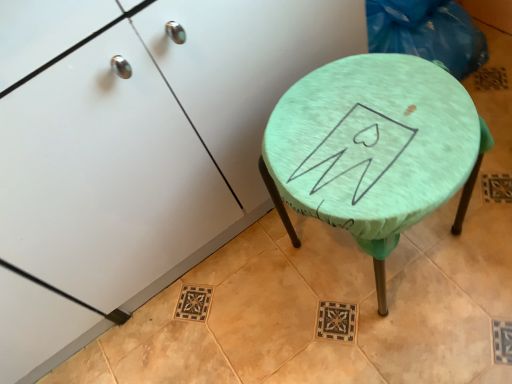
Question: Can you see mint fabric-covered stool at center-right touching teal fabric-covered stool at center?

Choices:
 (A) yes
 (B) no

Answer: (B)

Question: Is mint fabric-covered stool at center-right surrounding teal fabric-covered stool at center?

Choices:
 (A) yes
 (B) no

Answer: (B)

Question: Is mint fabric-covered stool at center-right at the left side of teal fabric-covered stool at center?

Choices:
 (A) no
 (B) yes

Answer: (B)

Question: Is mint fabric-covered stool at center-right positioned beyond the bounds of teal fabric-covered stool at center?

Choices:
 (A) no
 (B) yes

Answer: (B)

Question: Does mint fabric-covered stool at center-right lie behind teal fabric-covered stool at center?

Choices:
 (A) no
 (B) yes

Answer: (A)

Question: Is mint fabric-covered stool at center-right taller than teal fabric-covered stool at center?

Choices:
 (A) yes
 (B) no

Answer: (A)

Question: Could you tell me if teal fabric-covered stool at center is turned towards mint fabric-covered stool at center-right?

Choices:
 (A) no
 (B) yes

Answer: (A)

Question: Is teal fabric-covered stool at center positioned far away from mint fabric-covered stool at center-right?

Choices:
 (A) yes
 (B) no

Answer: (B)

Question: Does teal fabric-covered stool at center appear on the left side of mint fabric-covered stool at center-right?

Choices:
 (A) yes
 (B) no

Answer: (B)

Question: Considering the relative sizes of teal fabric-covered stool at center and mint fabric-covered stool at center-right in the image provided, is teal fabric-covered stool at center smaller than mint fabric-covered stool at center-right?

Choices:
 (A) yes
 (B) no

Answer: (A)

Question: From the image's perspective, is teal fabric-covered stool at center under mint fabric-covered stool at center-right?

Choices:
 (A) no
 (B) yes

Answer: (B)

Question: From a real-world perspective, does teal fabric-covered stool at center sit lower than mint fabric-covered stool at center-right?

Choices:
 (A) yes
 (B) no

Answer: (A)

Question: From the image's perspective, is teal fabric-covered stool at center located above or below mint fabric-covered stool at center-right?

Choices:
 (A) above
 (B) below

Answer: (B)